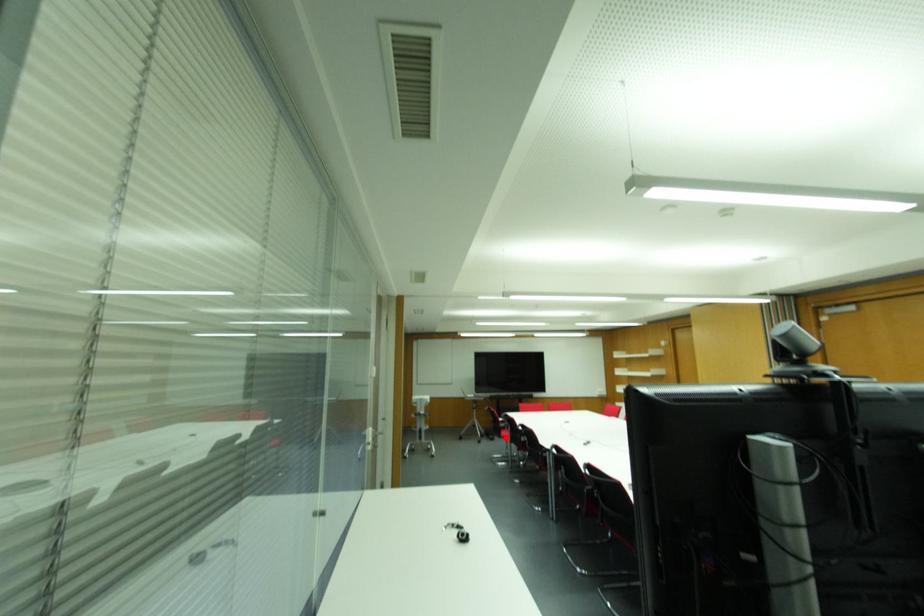
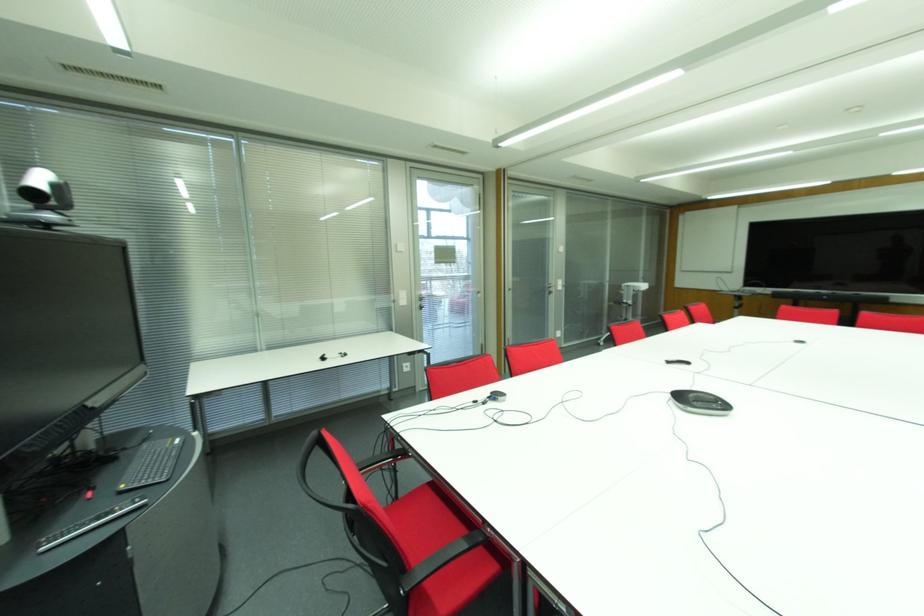
Question: I am providing you with two images of the same scene from different viewpoints. A red point is marked on the first image. Is the red point's position out of view in image 2?

Choices:
 (A) Yes
 (B) No

Answer: (A)